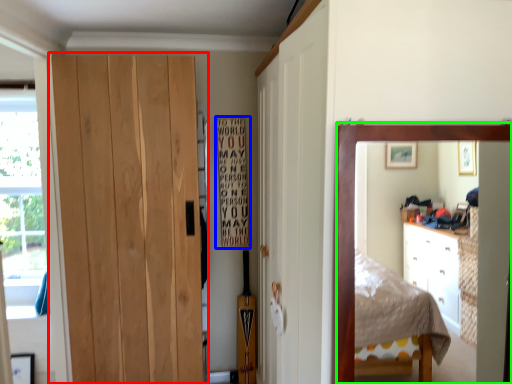
Question: Based on their relative distances, which object is nearer to door (highlighted by a red box)? Choose from bulletin board (highlighted by a blue box) and mirror (highlighted by a green box).

Choices:
 (A) bulletin board
 (B) mirror

Answer: (A)